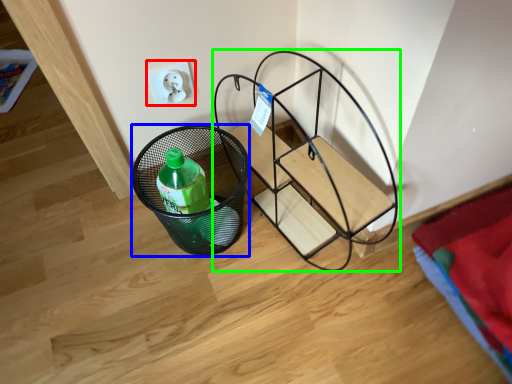
Question: Which object is positioned closest to electric outlet (highlighted by a red box)? Select from basket (highlighted by a blue box) and furniture (highlighted by a green box).

Choices:
 (A) basket
 (B) furniture

Answer: (A)